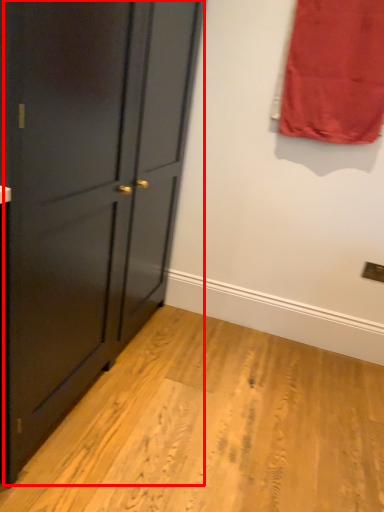
Question: Where is door (annotated by the red box) located in relation to curtain in the image?

Choices:
 (A) right
 (B) left

Answer: (B)